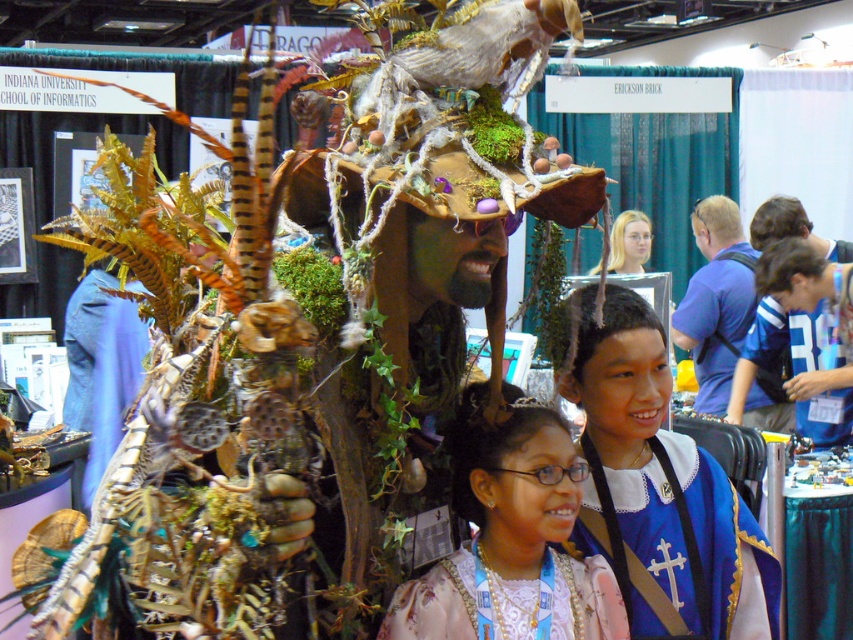
Which is more to the left, blue velvet sash at center or blonde hair at upper center?

Positioned to the left is blue velvet sash at center.

Is blue velvet sash at center thinner than blonde hair at upper center?

Incorrect, blue velvet sash at center's width is not less than blonde hair at upper center's.

Does point (770, 627) come farther from viewer compared to point (621, 262)?

No, it is in front of (621, 262).

Identify the location of blue velvet sash at center. The width and height of the screenshot is (853, 640). (674, 540).

From the picture: Who is more forward, (733,221) or (642,268)?

Point (733,221)

In order to click on blue fabric shirt at right in this screenshot , I will do `click(715, 301)`.

Who is more forward, (x=709, y=349) or (x=634, y=230)?

Point (x=709, y=349)

Image resolution: width=853 pixels, height=640 pixels. What are the coordinates of `blue fabric shirt at right` in the screenshot? It's located at (715, 301).

Between pearl necklace at center and blue fabric shirt at right, which one is positioned lower?

pearl necklace at center

Where is `pearl necklace at center`? The image size is (853, 640). pearl necklace at center is located at coordinates (508, 602).